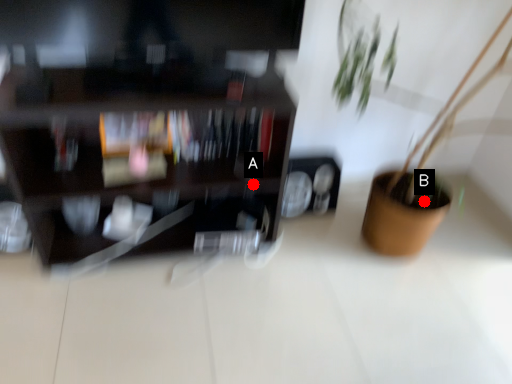
Question: Two points are circled on the image, labeled by A and B beside each circle. Which point is further to the camera?

Choices:
 (A) A is further
 (B) B is further

Answer: (B)